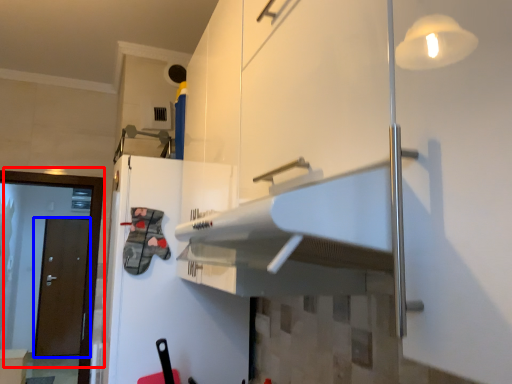
Question: Which point is closer to the camera, door (highlighted by a red box) or door (highlighted by a blue box)?

Choices:
 (A) door
 (B) door

Answer: (A)